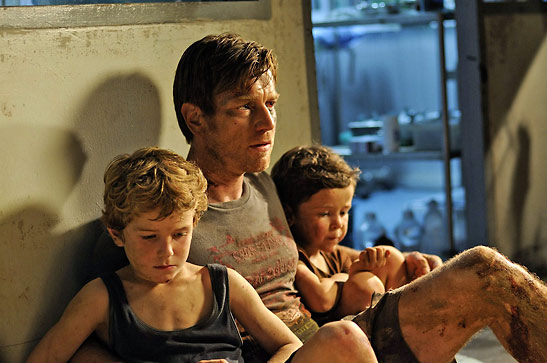
You are a GUI agent. You are given a task and a screenshot of the screen. Output one action in this format:
    pyautogui.click(x=<x>, y=<y>)
    Task: Click on the wall
    
    Given the screenshot: What is the action you would take?
    pyautogui.click(x=81, y=55)